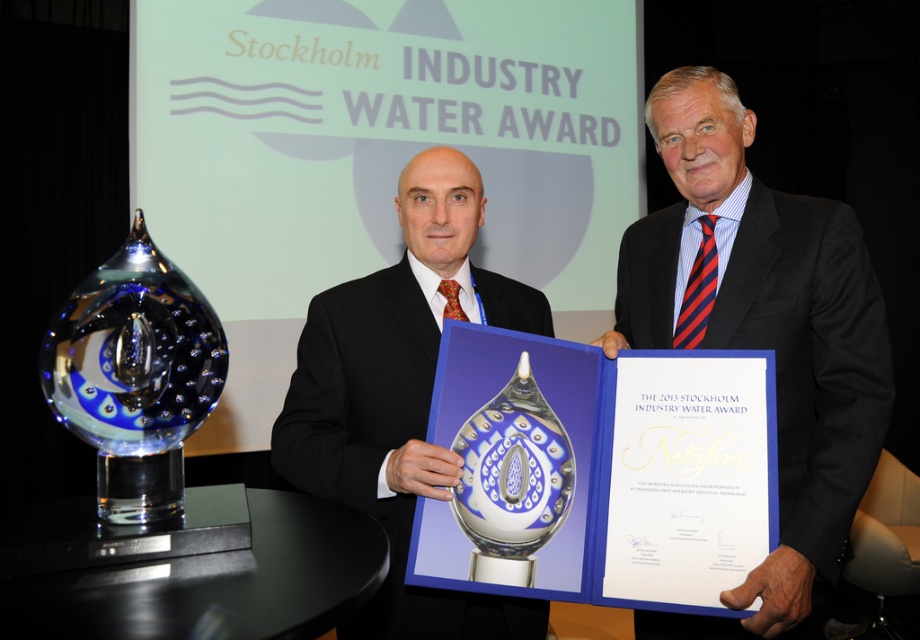
In the scene shown: You are an event organizer at the Stockholm Industry Water Award ceremony. You need to place a 15 cm tall decorative stand in front of the blue glass trophy at left and transparent glass trophy at center. Which trophy should the stand be placed in front of to ensure it doesn stand out too much?

The blue glass trophy at left is taller than the transparent glass trophy at center. To ensure the stand doesn stand out too much, place it in front of the transparent glass trophy at center since it is shorter and the stand will be less noticeable there.

You are a photographer at the Stockholm Industry Water Award ceremony. You need to capture a photo that includes both the blue glass trophy at left and the transparent glass trophy at center. The camera you are using has a maximum focus range of 20 inches. Will you be able to include both trophies in the same frame without moving the camera?

The distance between the blue glass trophy at left and the transparent glass trophy at center is 20.76 inches. Since the camera can only focus up to 20 inches, you won the camera won won won won won won won won won won won won won won won won won won won won won won won won won won won won won won won won won won won won won won won won won won won won won won won won won won won won won won won won won won won won won won won won won won won won won won won won won won won won won won won won won won won 2